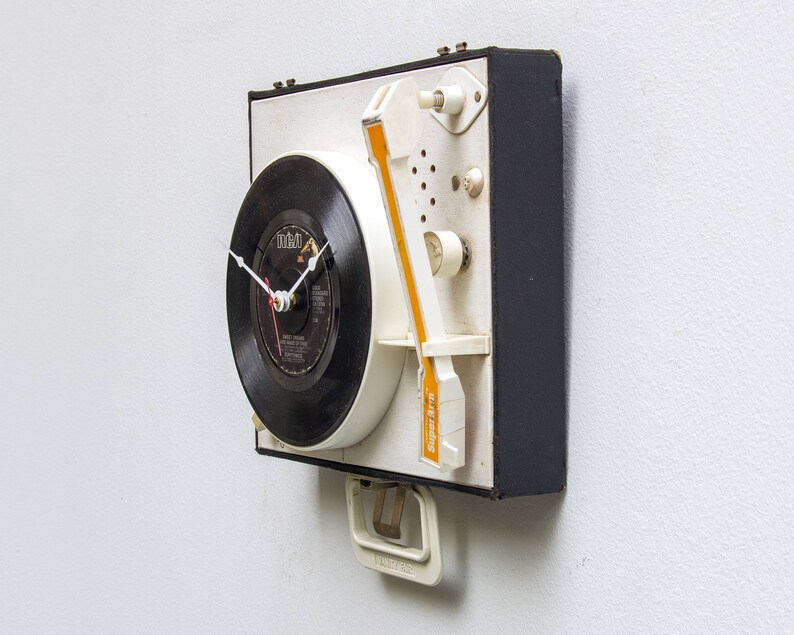
This screenshot has height=635, width=794. I want to click on knob, so click(437, 248).